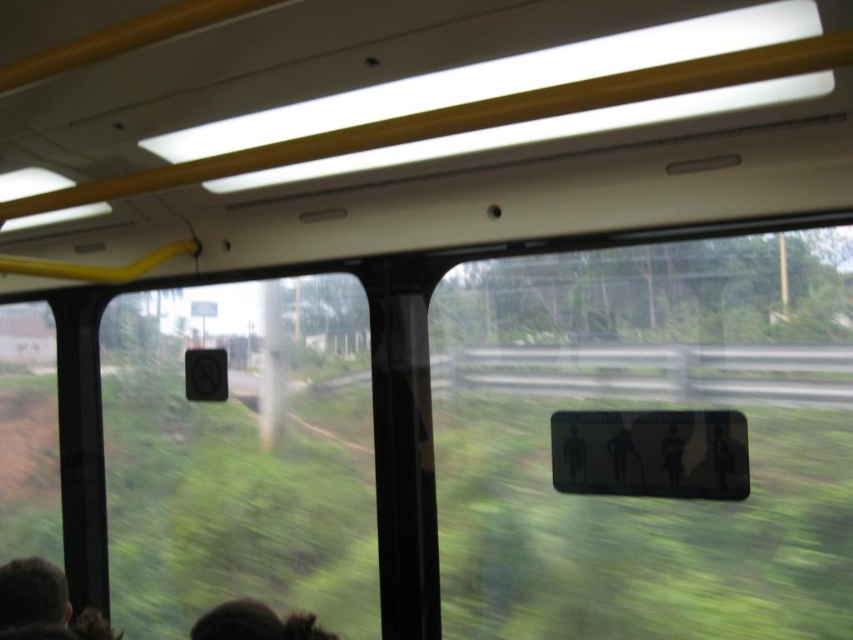
Looking at this image, you are a passenger on a bus and you see a transparent plastic sign at center and a dark brown hair at lower left. Which object is higher in the bus?

The transparent plastic sign at center is above the dark brown hair at lower left, so it is higher.

You are a passenger on a bus and you want to read the transparent plastic sign at center. However, your view is partially blocked by the dark brown hair at lower left. Can you move to the right or left to get a better view of the sign?

Since the transparent plastic sign at center is to the right of the dark brown hair at lower left, moving to the right would allow you to see around the obstruction caused by the dark brown hair at lower left and get a better view of the sign.